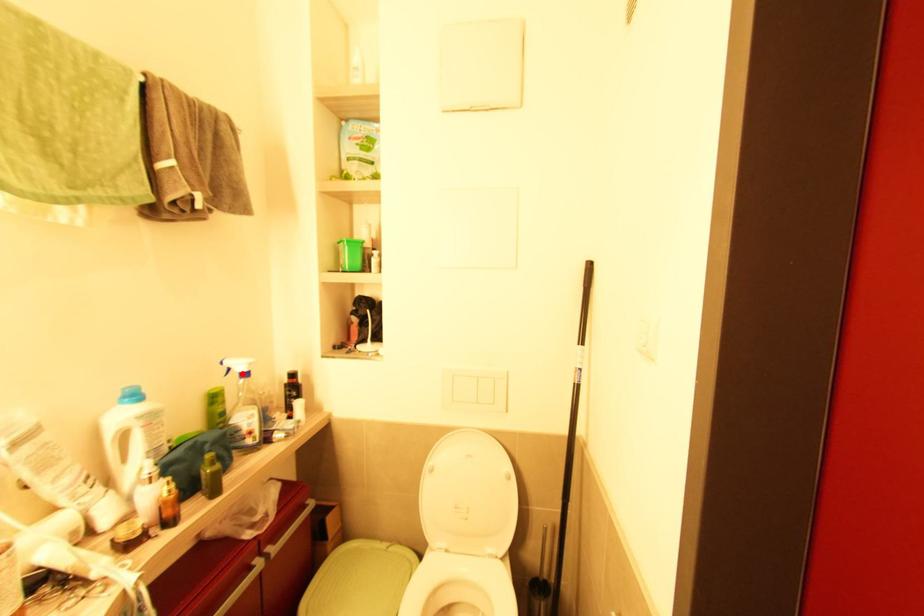
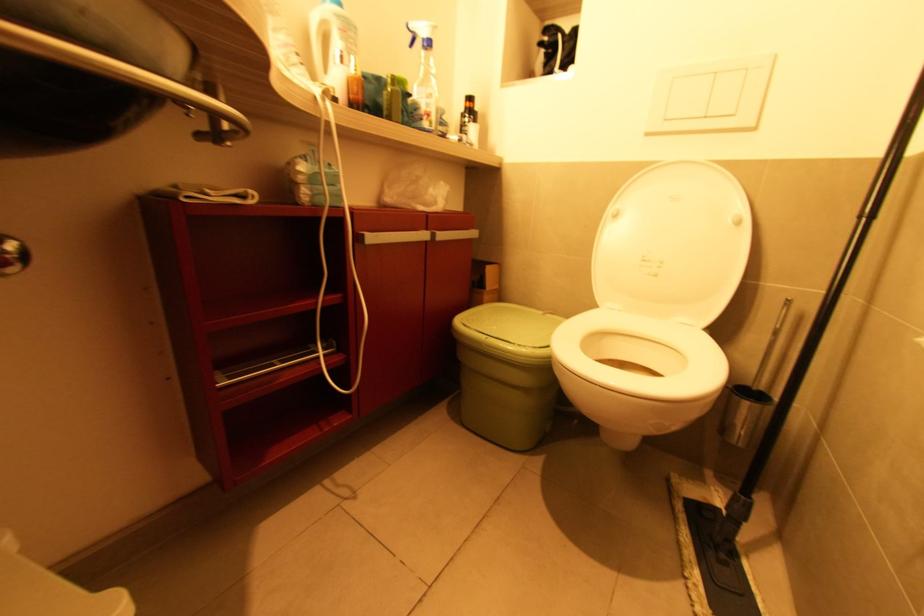
The point at the highlighted location is marked in the first image. Where is the corresponding point in the second image?

(427, 42)